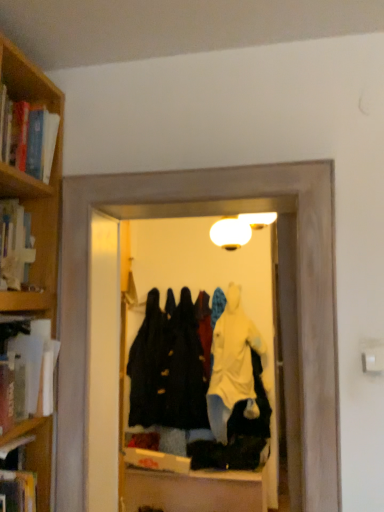
Question: Does hardcover book at left, arranged as the third book when ordered from the bottom, turn towards hardcover book at left, acting as the 4th book starting from the top?

Choices:
 (A) no
 (B) yes

Answer: (A)

Question: Are hardcover book at left, arranged as the third book when ordered from the bottom, and hardcover book at left, the first book ordered from the bottom, located far from each other?

Choices:
 (A) yes
 (B) no

Answer: (B)

Question: Does hardcover book at left, arranged as the third book when ordered from the bottom, have a larger size compared to hardcover book at left, acting as the 4th book starting from the top?

Choices:
 (A) no
 (B) yes

Answer: (A)

Question: Does hardcover book at left, arranged as the third book when ordered from the bottom, have a smaller size compared to hardcover book at left, the first book ordered from the bottom?

Choices:
 (A) yes
 (B) no

Answer: (A)

Question: Is hardcover book at left, which ranks as the second book in top-to-bottom order, thinner than hardcover book at left, the first book ordered from the bottom?

Choices:
 (A) no
 (B) yes

Answer: (B)

Question: Is hardcover book at left, which ranks as the second book in top-to-bottom order, with hardcover book at left, the first book ordered from the bottom?

Choices:
 (A) no
 (B) yes

Answer: (A)

Question: Can we say black matte coat at center lies outside transparent plastic coat rack at center?

Choices:
 (A) no
 (B) yes

Answer: (B)

Question: Is black matte coat at center behind transparent plastic coat rack at center?

Choices:
 (A) yes
 (B) no

Answer: (A)

Question: Can you confirm if black matte coat at center is positioned to the right of transparent plastic coat rack at center?

Choices:
 (A) no
 (B) yes

Answer: (A)

Question: From the image's perspective, is black matte coat at center above transparent plastic coat rack at center?

Choices:
 (A) no
 (B) yes

Answer: (A)

Question: Is black matte coat at center at the left side of transparent plastic coat rack at center?

Choices:
 (A) no
 (B) yes

Answer: (B)

Question: Does black matte coat at center have a smaller size compared to transparent plastic coat rack at center?

Choices:
 (A) no
 (B) yes

Answer: (A)

Question: Is black matte coat at center far away from wooden bookshelf at upper left, the 1th book viewed from the top?

Choices:
 (A) no
 (B) yes

Answer: (B)